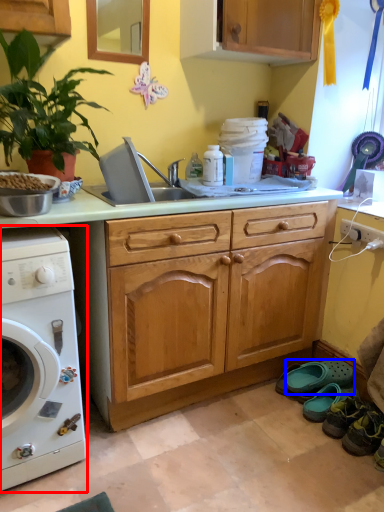
Question: Which point is further to the camera, washing machine (highlighted by a red box) or shoe (highlighted by a blue box)?

Choices:
 (A) washing machine
 (B) shoe

Answer: (B)